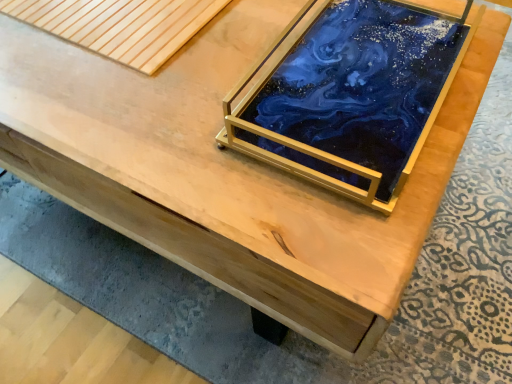
Question: Is blue resin tray at center inside or outside of natural wood plank at upper left?

Choices:
 (A) inside
 (B) outside

Answer: (B)

Question: Is point (374, 119) closer or farther from the camera than point (152, 14)?

Choices:
 (A) farther
 (B) closer

Answer: (B)

Question: Considering the positions of blue resin tray at center and natural wood plank at upper left in the image, is blue resin tray at center taller or shorter than natural wood plank at upper left?

Choices:
 (A) short
 (B) tall

Answer: (B)

Question: From a real-world perspective, is natural wood plank at upper left above or below blue resin tray at center?

Choices:
 (A) below
 (B) above

Answer: (A)

Question: Is natural wood plank at upper left taller or shorter than blue resin tray at center?

Choices:
 (A) tall
 (B) short

Answer: (B)

Question: In the image, is natural wood plank at upper left on the left side or the right side of blue resin tray at center?

Choices:
 (A) right
 (B) left

Answer: (B)

Question: Which is correct: natural wood plank at upper left is inside blue resin tray at center, or outside of it?

Choices:
 (A) inside
 (B) outside

Answer: (B)